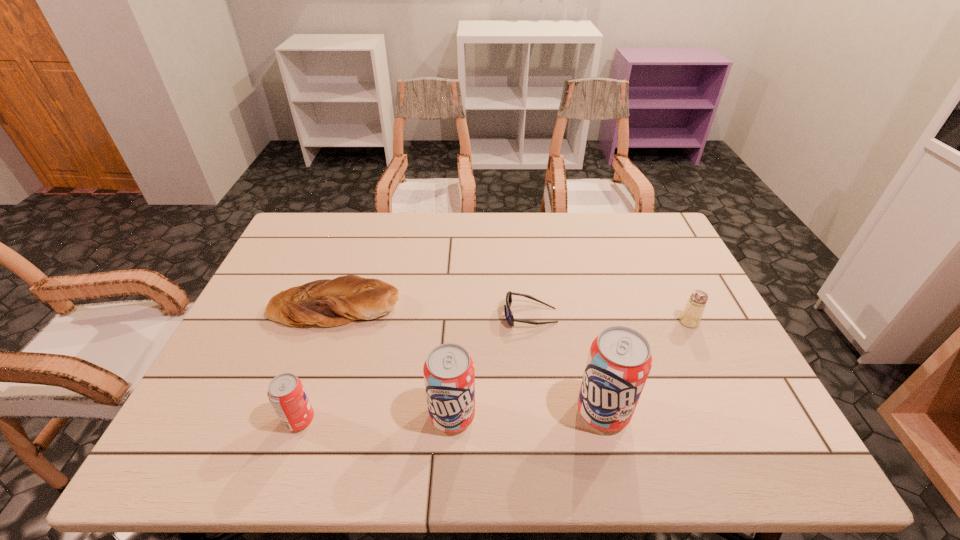
Please point a spot on the right to add another soda can. Please provide its 2D coordinates. Your answer should be formatted as a tuple, i.e. [(x, y)], where the tuple contains the x and y coordinates of a point satisfying the conditions above.

[(752, 408)]